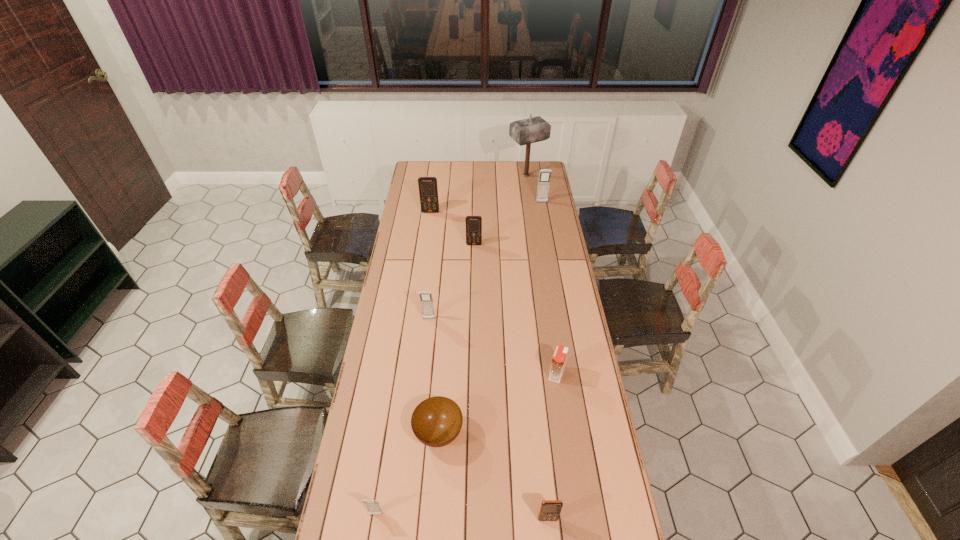
Where is `the farthest object`? the farthest object is located at coordinates (534, 129).

The height and width of the screenshot is (540, 960). Identify the location of mallet. (534, 129).

In order to click on the farthest cellular telephone in this screenshot , I will do `click(545, 174)`.

The height and width of the screenshot is (540, 960). I want to click on the biggest gray cellular telephone, so click(x=545, y=174).

This screenshot has width=960, height=540. I want to click on the biggest orange cellular telephone, so (428, 190).

Find the location of a particular element. the seventh nearest object is located at coordinates (428, 190).

Locate an element on the screen. The height and width of the screenshot is (540, 960). the fifth farthest object is located at coordinates (426, 299).

This screenshot has width=960, height=540. What are the coordinates of `the fourth farthest cellular telephone` in the screenshot? It's located at (426, 299).

The width and height of the screenshot is (960, 540). Identify the location of the second nearest orange cellular telephone. (x=473, y=223).

Find the location of a particular element. The height and width of the screenshot is (540, 960). the second smallest orange cellular telephone is located at coordinates (473, 223).